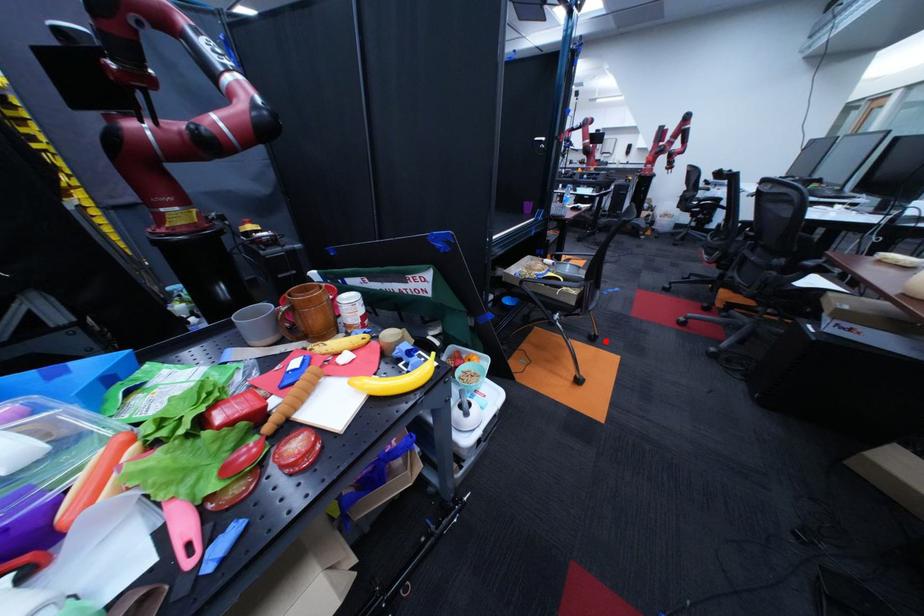
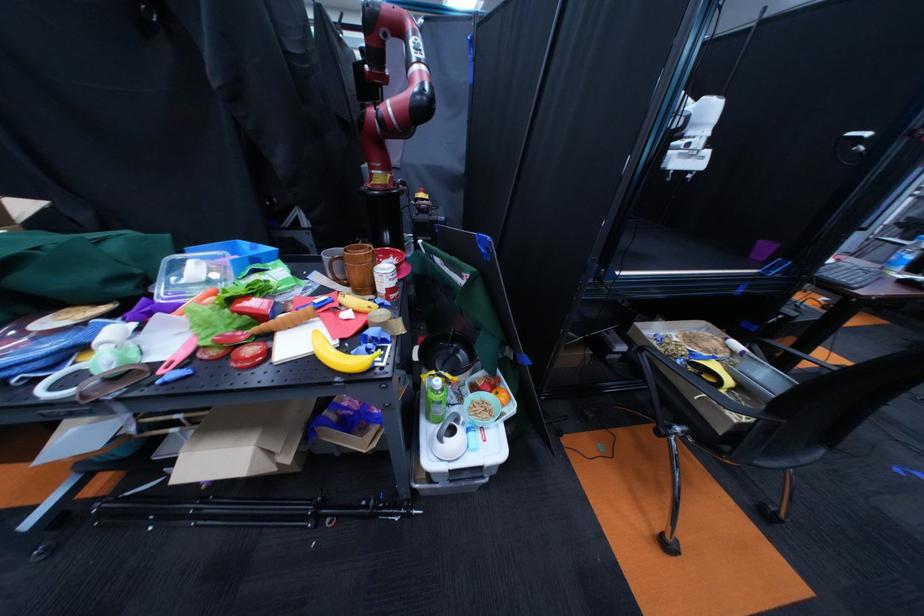
Question: I am providing you with two images of the same scene from different viewpoints. In image1, a red point is highlighted. Considering the same 3D point in image2, which of the following is correct?

Choices:
 (A) It is closer
 (B) It is farther

Answer: (A)